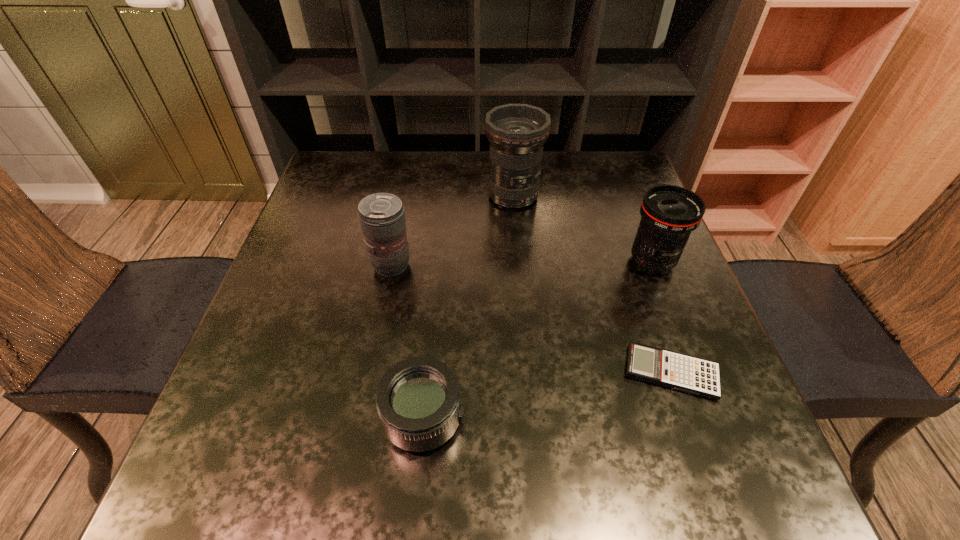
Where is `telephoto lens that is the third closest to the nearest telephoto lens`? Image resolution: width=960 pixels, height=540 pixels. telephoto lens that is the third closest to the nearest telephoto lens is located at coordinates (517, 132).

At what (x,y) coordinates should I click in order to perform the action: click on telephoto lens that stands as the closest to the nearest telephoto lens. Please return your answer as a coordinate pair (x, y). Looking at the image, I should click on (382, 218).

At what (x,y) coordinates should I click in order to perform the action: click on vacant space that satisfies the following two spatial constraints: 1. on the front side of the rightmost telephoto lens; 2. on the side of the shortest telephoto lens with brand markings and control switches. Please return your answer as a coordinate pair (x, y). Looking at the image, I should click on (713, 418).

At what (x,y) coordinates should I click in order to perform the action: click on free spot that satisfies the following two spatial constraints: 1. on the front side of the shortest object; 2. on the left side of the third object from left to right. Please return your answer as a coordinate pair (x, y). Image resolution: width=960 pixels, height=540 pixels. Looking at the image, I should click on (529, 372).